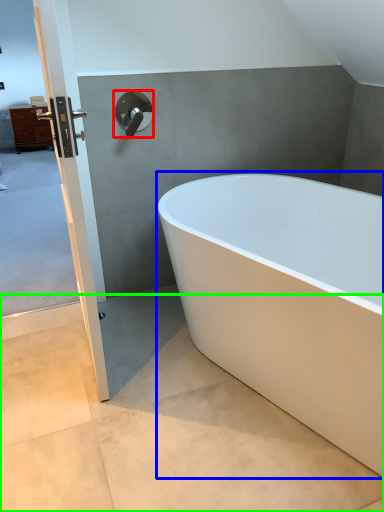
Question: Which is nearer to the tap (highlighted by a red box)? bathtub (highlighted by a blue box) or concrete (highlighted by a green box).

Choices:
 (A) bathtub
 (B) concrete

Answer: (A)